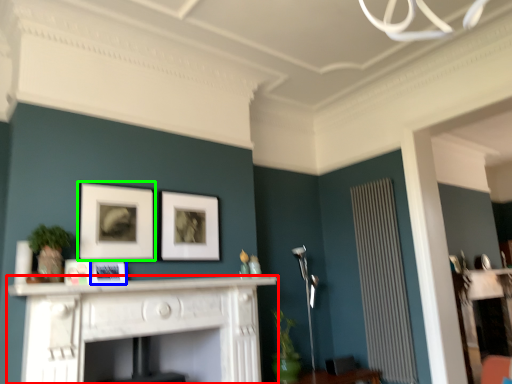
Question: Considering the real-world distances, which object is closest to fireplace (highlighted by a red box)? picture frame (highlighted by a blue box) or picture frame (highlighted by a green box).

Choices:
 (A) picture frame
 (B) picture frame

Answer: (A)